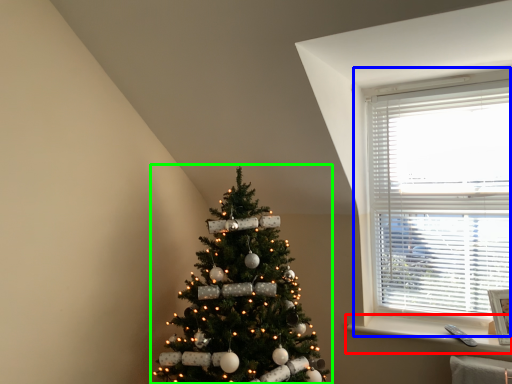
Question: Which object is the closest to the window sill (highlighted by a red box)? Choose among these: window (highlighted by a blue box) or christmas tree (highlighted by a green box).

Choices:
 (A) window
 (B) christmas tree

Answer: (A)